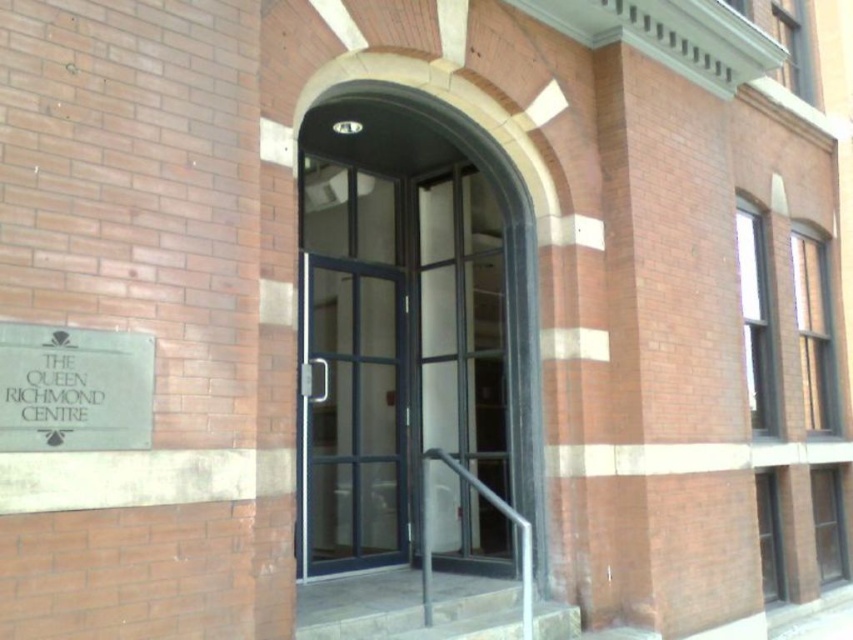
Is silver metallic sign at lower left wider than matte glass door at center?

No.

Who is more distant from viewer, (80,349) or (520,253)?

Positioned behind is point (520,253).

Identify the location of silver metallic sign at lower left. (74, 388).

Is silver metallic sign at lower left to the right of gray concrete stairs at lower center from the viewer's perspective?

No, silver metallic sign at lower left is not to the right of gray concrete stairs at lower center.

In the scene shown: How distant is silver metallic sign at lower left from gray concrete stairs at lower center?

silver metallic sign at lower left is 1.71 meters from gray concrete stairs at lower center.

Where is `silver metallic sign at lower left`? silver metallic sign at lower left is located at coordinates (74, 388).

Find the location of a particular element. The image size is (853, 640). silver metallic sign at lower left is located at coordinates (74, 388).

The height and width of the screenshot is (640, 853). What do you see at coordinates (506, 284) in the screenshot?
I see `matte glass door at center` at bounding box center [506, 284].

Can you confirm if matte glass door at center is bigger than gray concrete stairs at lower center?

Indeed, matte glass door at center has a larger size compared to gray concrete stairs at lower center.

Is point (480, 160) positioned after point (514, 605)?

That is True.

I want to click on matte glass door at center, so click(x=506, y=284).